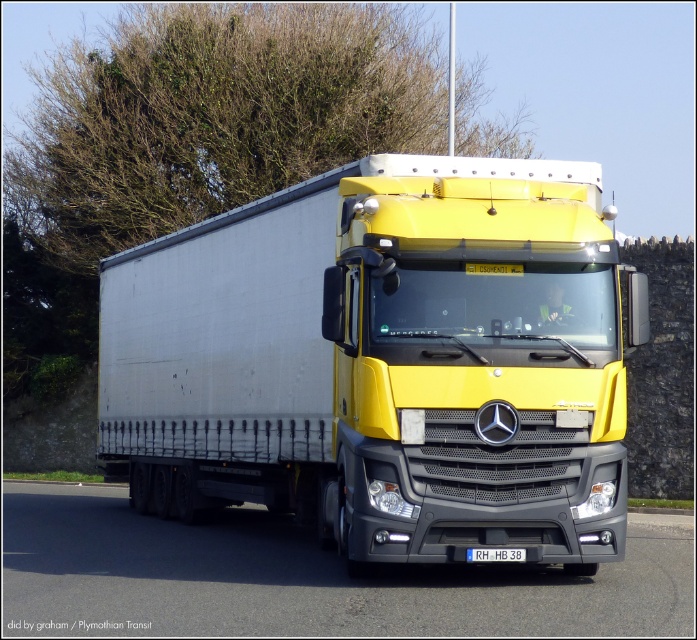
You are a photographer planning to capture the white matte trailer at center and the green leafy tree at upper center in a single frame. Based on their sizes in the image, which object would appear narrower in the photo?

The white matte trailer at center appears narrower in the photo because its width is less than that of the green leafy tree at upper center.

You are a photographer planning to take a photo of the white matte trailer at center and the green leafy tree at upper center. Based on their sizes in the image, which object should you focus on first if you want to ensure both are in sharp focus?

The white matte trailer at center is shorter than the green leafy tree at upper center. To ensure both are in sharp focus, you should focus on the green leafy tree at upper center first since it is taller and likely further away, allowing the trailer to fall within the depth of field.

You are a photographer trying to capture the white matte trailer at center in your shot. The camera is positioned at the point marked by coordinates point (x=383, y=362). Can you confirm whether the trailer is directly in front of the camera?

Yes, the point (x=383, y=362) marks the white matte trailer at center, so the trailer is directly in front of the camera.